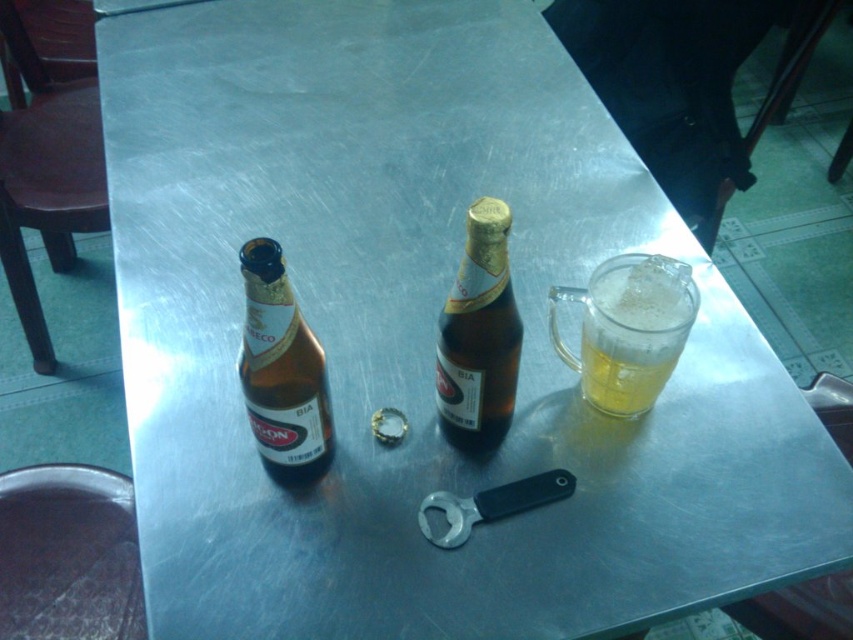
You are a bartender who needs to place a new glass at coordinate point 0.5, 0.7. Is there enough space to place it there without overlapping the translucent glass mug at right?

The translucent glass mug at right is already at point (628,330), so placing a new glass at (596,320) would be too close and likely overlap. Choose a different location.